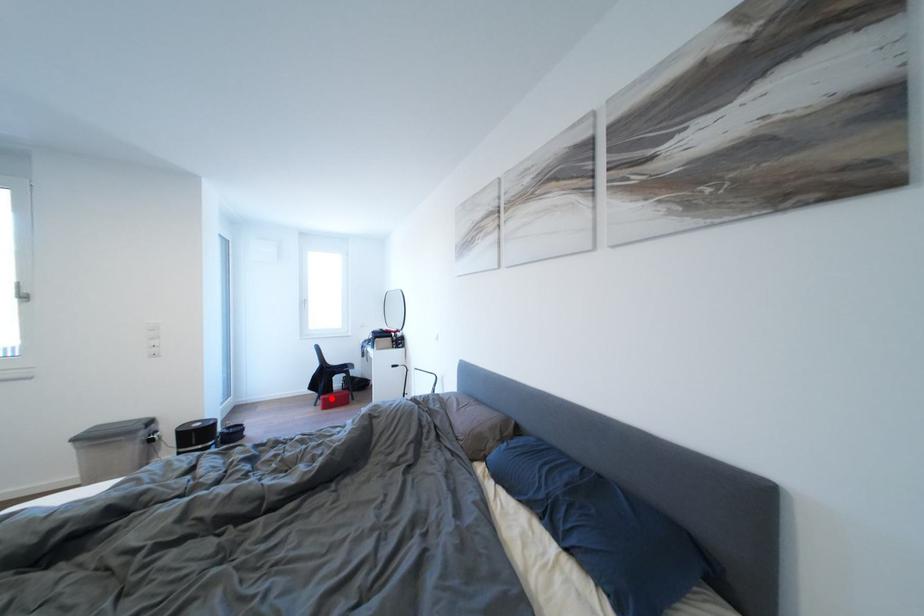
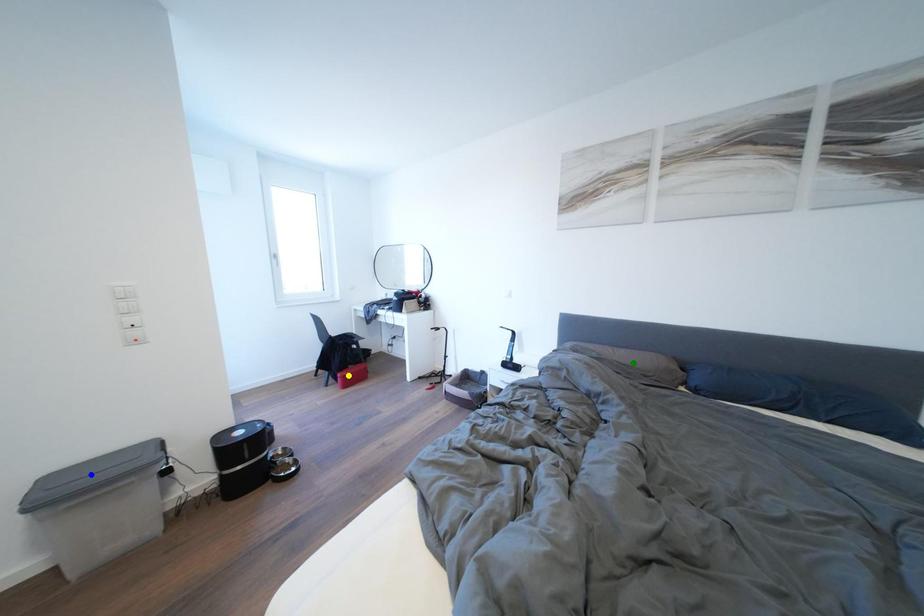
Question: I am providing you with two images of the same scene from different viewpoints. A red point is marked on the first image. You are given multiple points on the second image. Which spot in image 2 lines up with the point in image 1?

Choices:
 (A) yellow point
 (B) green point
 (C) blue point

Answer: (A)